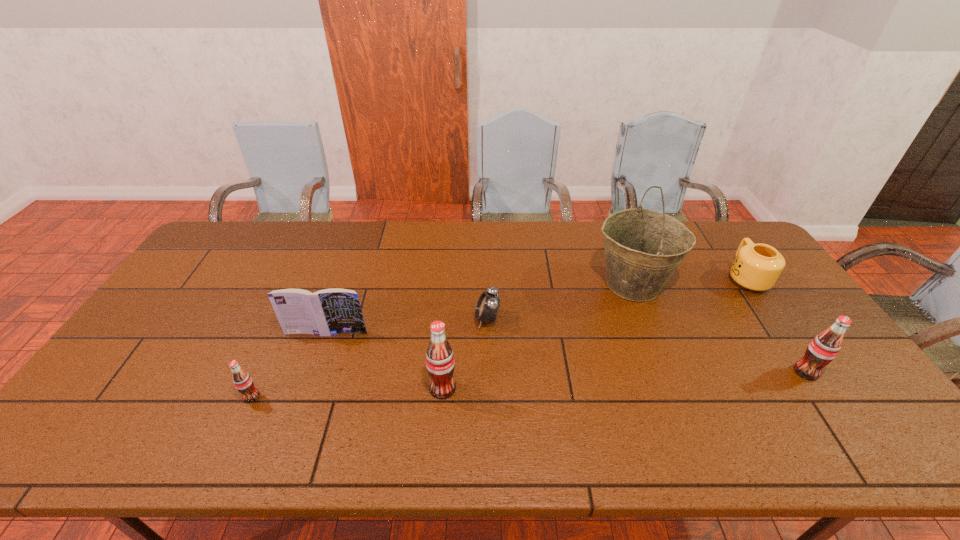
You are a GUI agent. You are given a task and a screenshot of the screen. Output one action in this format:
    pyautogui.click(x=<x>, y=<y>)
    Task: Click on the free point between the shortest soda and the book
    The width and height of the screenshot is (960, 540).
    Given the screenshot: What is the action you would take?
    pyautogui.click(x=289, y=364)

Find the location of a particular element. The height and width of the screenshot is (540, 960). free space between the fifth object from left to right and the second soda from left to right is located at coordinates (538, 336).

At what (x,y) coordinates should I click in order to perform the action: click on vacant area that lies between the third object from left to right and the shortest soda. Please return your answer as a coordinate pair (x, y). This screenshot has height=540, width=960. Looking at the image, I should click on (348, 393).

Locate an element on the screen. This screenshot has width=960, height=540. vacant space that's between the second shortest soda and the third object from right to left is located at coordinates (719, 328).

You are a GUI agent. You are given a task and a screenshot of the screen. Output one action in this format:
    pyautogui.click(x=<x>, y=<y>)
    Task: Click on the unoccupied area between the book and the leftmost soda
    This screenshot has width=960, height=540.
    Given the screenshot: What is the action you would take?
    pyautogui.click(x=289, y=364)

At what (x,y) coordinates should I click in order to perform the action: click on free space that is in between the alarm clock and the third object from right to left. Please return your answer as a coordinate pair (x, y). Looking at the image, I should click on coord(560,302).

Locate an element on the screen. Image resolution: width=960 pixels, height=540 pixels. blank region between the rightmost soda and the fourth object from right to left is located at coordinates [x=646, y=346].

This screenshot has height=540, width=960. In order to click on object that is the third nearest to the mug in this screenshot , I will do `click(488, 304)`.

Point out which object is positioned as the nearest to the book. Please provide its 2D coordinates. Your answer should be formatted as a tuple, i.e. [(x, y)], where the tuple contains the x and y coordinates of a point satisfying the conditions above.

[(243, 382)]

Identify which soda is the third nearest to the mug. Please provide its 2D coordinates. Your answer should be formatted as a tuple, i.e. [(x, y)], where the tuple contains the x and y coordinates of a point satisfying the conditions above.

[(243, 382)]